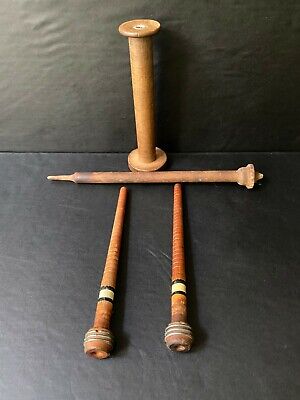
Where is `wall`? Image resolution: width=300 pixels, height=400 pixels. wall is located at coordinates (208, 81).